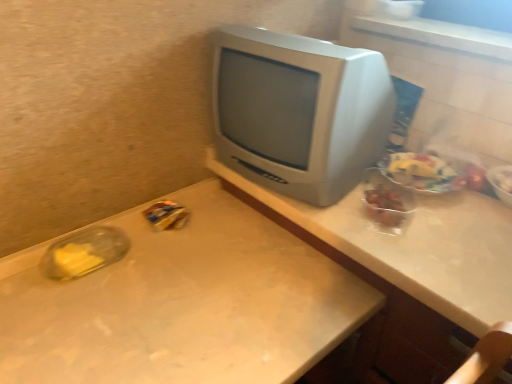
Locate an element on the screen. This screenshot has width=512, height=384. vacant area on top of white matte desk at center (from a real-world perspective) is located at coordinates point(177,297).